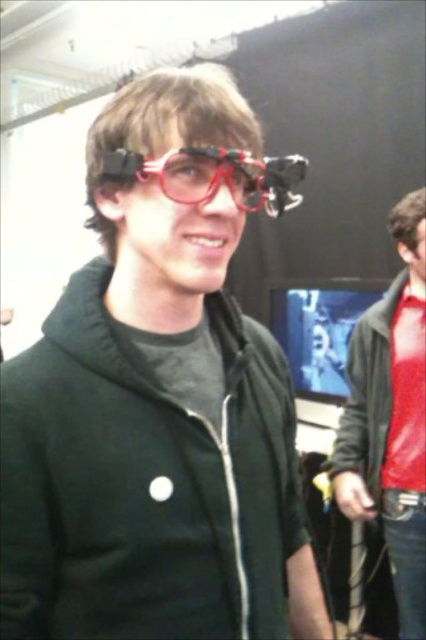
Which is more to the right, matte black jacket at right or transparent plastic goggles at center?

matte black jacket at right is more to the right.

Which is behind, point (400, 202) or point (187, 156)?

Positioned behind is point (400, 202).

At what (x,y) coordinates should I click in order to perform the action: click on matte black jacket at right. Please return your answer as a coordinate pair (x, y). The width and height of the screenshot is (426, 640). Looking at the image, I should click on (391, 419).

Does matte black jacket at center come in front of matte black jacket at right?

Yes, matte black jacket at center is in front of matte black jacket at right.

Describe the element at coordinates (158, 401) in the screenshot. The image size is (426, 640). I see `matte black jacket at center` at that location.

Find the location of a particular element. Image resolution: width=426 pixels, height=640 pixels. matte black jacket at center is located at coordinates (158, 401).

Can you confirm if matte black jacket at center is taller than transparent plastic goggles at center?

Yes.

Who is higher up, matte black jacket at center or transparent plastic goggles at center?

transparent plastic goggles at center

This screenshot has height=640, width=426. What are the coordinates of `matte black jacket at center` in the screenshot? It's located at (158, 401).